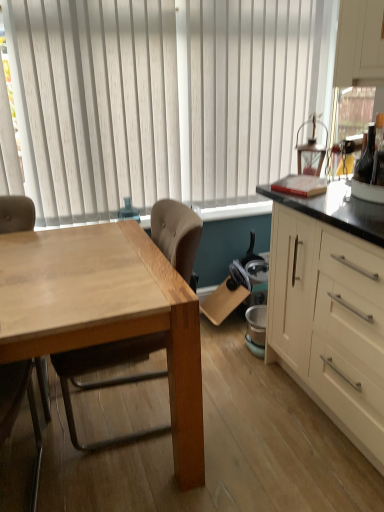
Question: From their relative heights in the image, would you say white vertical blinds at upper center is taller or shorter than light brown wood chair at left, which is the 1th chair in left-to-right order?

Choices:
 (A) tall
 (B) short

Answer: (A)

Question: Considering their positions, is white vertical blinds at upper center located in front of or behind light brown wood chair at left, which is the 1th chair in left-to-right order?

Choices:
 (A) front
 (B) behind

Answer: (B)

Question: Estimate the real-world distances between objects in this image. Which object is closer to the white vertical blinds at upper center?

Choices:
 (A) light brown wood chair at left, acting as the first chair starting from the right
 (B) light brown wood chair at left, which is the 1th chair in left-to-right order
 (C) white matte cabinet at right

Answer: (A)

Question: Which of these objects is positioned farthest from the white matte cabinet at right?

Choices:
 (A) light brown wood chair at left, acting as the 2th chair starting from the left
 (B) light brown wood chair at left, which is the 1th chair in left-to-right order
 (C) white vertical blinds at upper center

Answer: (B)